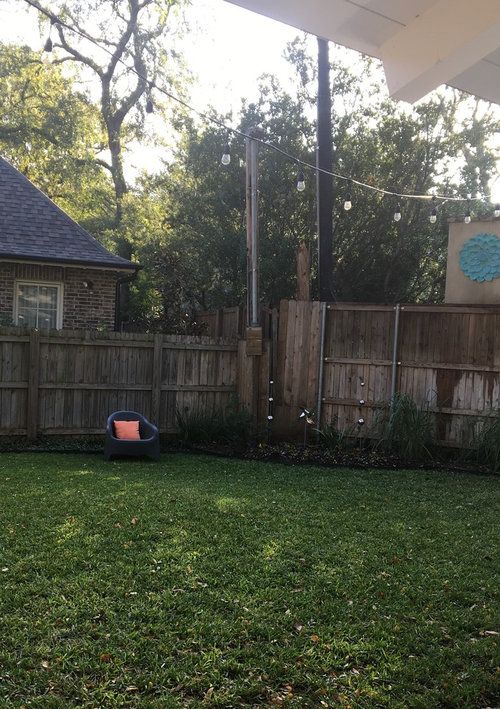
Where is `cable`? This screenshot has width=500, height=709. cable is located at coordinates (188, 108), (419, 196).